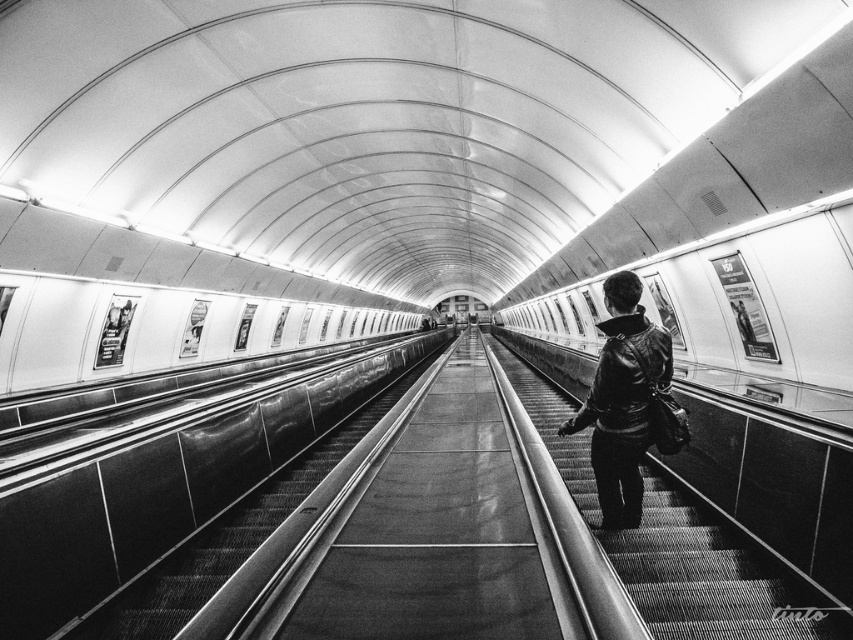
Which is below, metallic escalator at center or leather jacket at right?

metallic escalator at center is lower down.

Does point (183, 600) come farther from viewer compared to point (635, 522)?

No, it is not.

Where is `metallic escalator at center`? This screenshot has height=640, width=853. metallic escalator at center is located at coordinates (233, 532).

Does point (752, 634) come behind point (622, 364)?

That is False.

Where is `metallic escalator steps at center`? metallic escalator steps at center is located at coordinates (679, 541).

Is point (776, 588) less distant than point (163, 557)?

Yes, it is in front of point (163, 557).

Between point (730, 577) and point (144, 605), which one is positioned behind?

The point (730, 577) is behind.

The image size is (853, 640). In order to click on metallic escalator steps at center in this screenshot , I will do `click(679, 541)`.